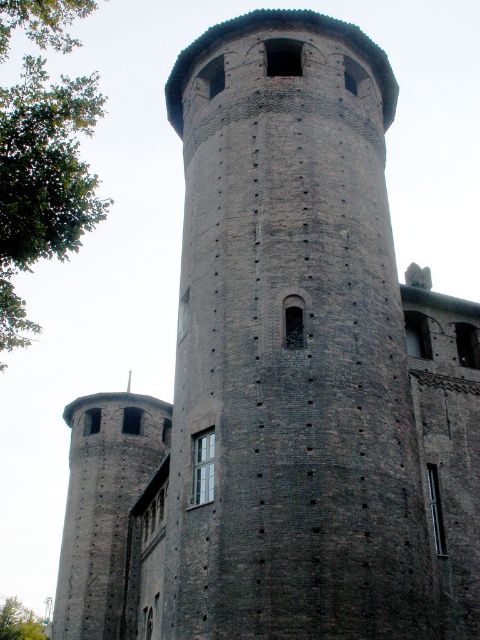
You are standing in front of the tower and see the green leafy tree at left and the green leafy tree at lower left. Which tree is closer to the right side of your view?

The green leafy tree at left is positioned on the right side of green leafy tree at lower left, so it is closer to the right side of your view.

You are standing in front of the tower and see two green leafy trees. Which one is closer to you, the green leafy tree at left or the green leafy tree at lower left?

The green leafy tree at left is closer to the viewer than the green leafy tree at lower left.

You are standing in front of the tower and want to know which tree has a larger width. Can you determine this by looking at the green leafy tree at left and the green leafy tree at lower left?

The green leafy tree at left might be wider than green leafy tree at lower left according to the description.